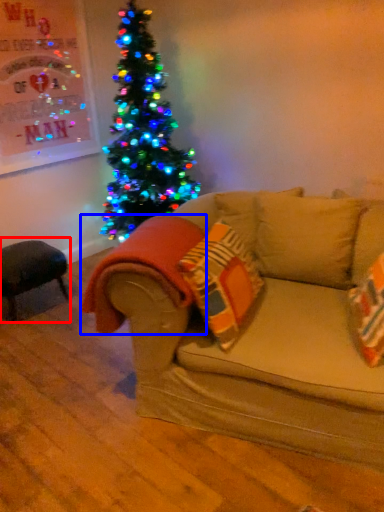
Question: Which object is further to the camera taking this photo, swivel chair (highlighted by a red box) or blanket (highlighted by a blue box)?

Choices:
 (A) swivel chair
 (B) blanket

Answer: (A)